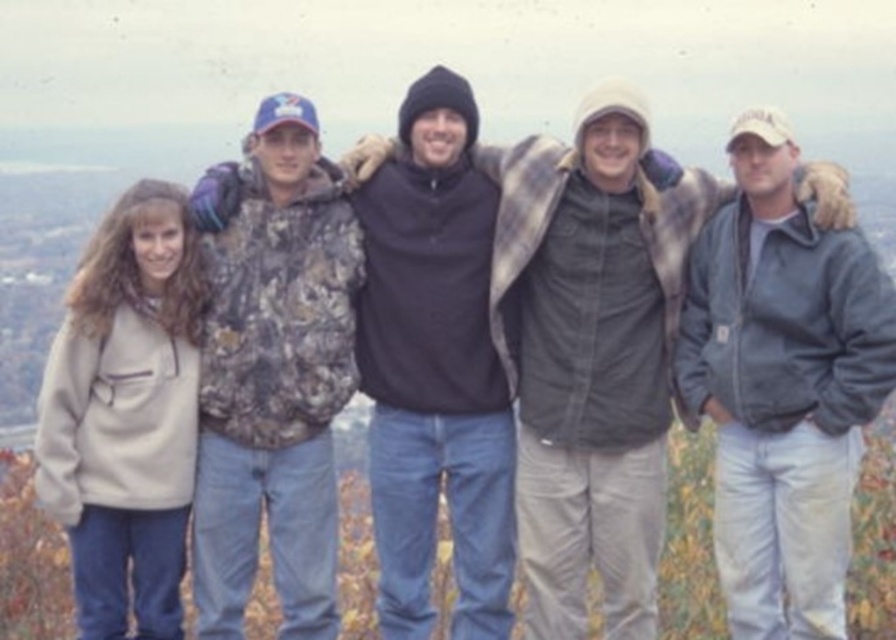
Which is more to the left, gray fleece jacket at center or black fleece jacket at center?

black fleece jacket at center is more to the left.

This screenshot has width=896, height=640. In order to click on gray fleece jacket at center in this screenshot , I will do pos(784,376).

Can you confirm if camo jacket at left is bigger than black fleece jacket at center?

Yes, camo jacket at left is bigger than black fleece jacket at center.

Which is more to the left, camo jacket at left or black fleece jacket at center?

From the viewer's perspective, camo jacket at left appears more on the left side.

At what (x,y) coordinates should I click in order to perform the action: click on camo jacket at left. Please return your answer as a coordinate pair (x, y). This screenshot has width=896, height=640. Looking at the image, I should click on (273, 371).

The image size is (896, 640). Identify the location of camo jacket at left. (273, 371).

Can you confirm if gray fleece jacket at center is positioned above camo jacket at left?

Correct, gray fleece jacket at center is located above camo jacket at left.

In the scene shown: Between gray fleece jacket at center and camo jacket at left, which one appears on the left side from the viewer's perspective?

From the viewer's perspective, camo jacket at left appears more on the left side.

Is point (741, 221) in front of point (260, 156)?

Yes, it is.

Locate an element on the screen. gray fleece jacket at center is located at coordinates (784, 376).